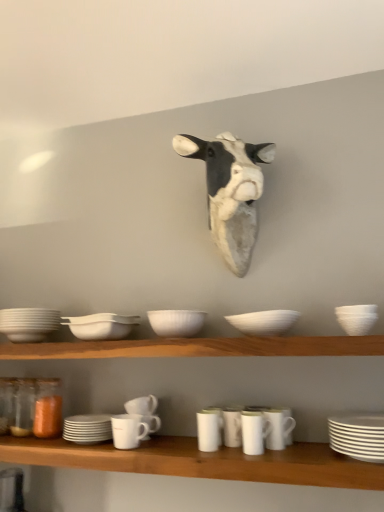
Where is `empty space that is to the right of white glossy mug at center, the 3th tableware from the right`? This screenshot has height=512, width=384. empty space that is to the right of white glossy mug at center, the 3th tableware from the right is located at coordinates (309, 450).